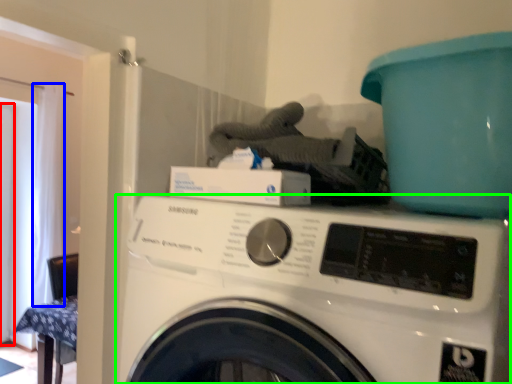
Question: Which is nearer to the screen door (highlighted by a red box)? curtain (highlighted by a blue box) or washing machine (highlighted by a green box).

Choices:
 (A) curtain
 (B) washing machine

Answer: (A)